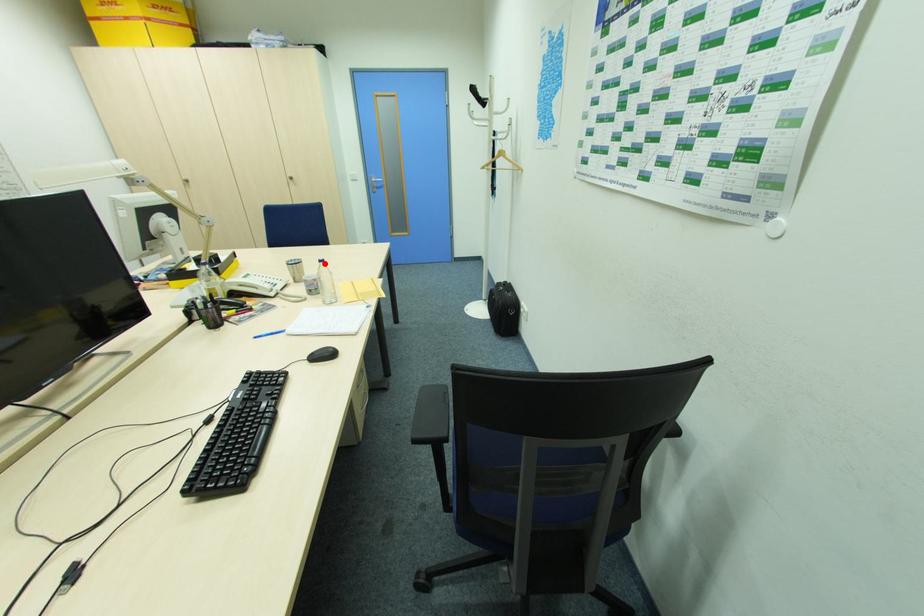
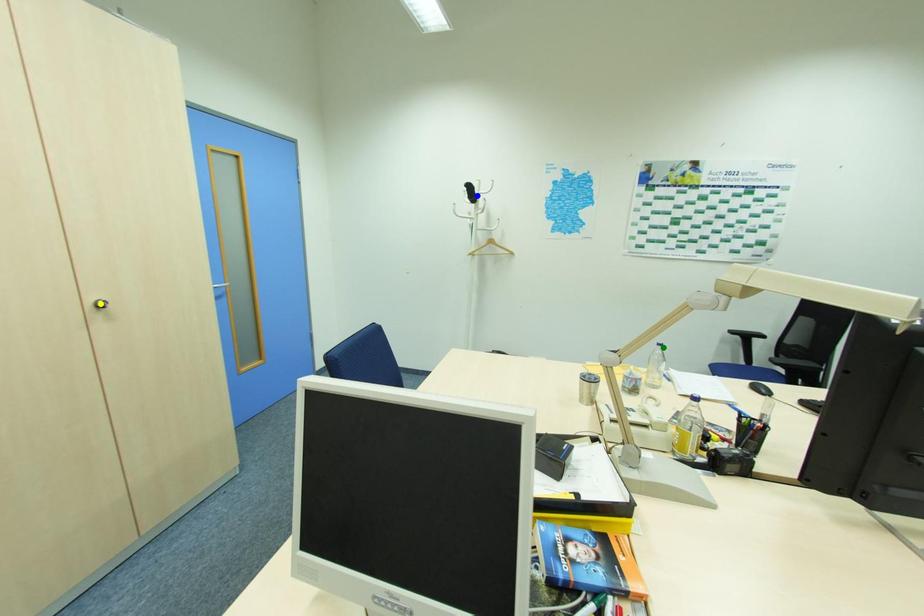
Question: I am providing you with two images of the same scene from different viewpoints. A red point is marked on the first image. You are given multiple points on the second image. Which point in image 2 represents the same 3d spot as the red point in image 1?

Choices:
 (A) green point
 (B) blue point
 (C) yellow point

Answer: (A)